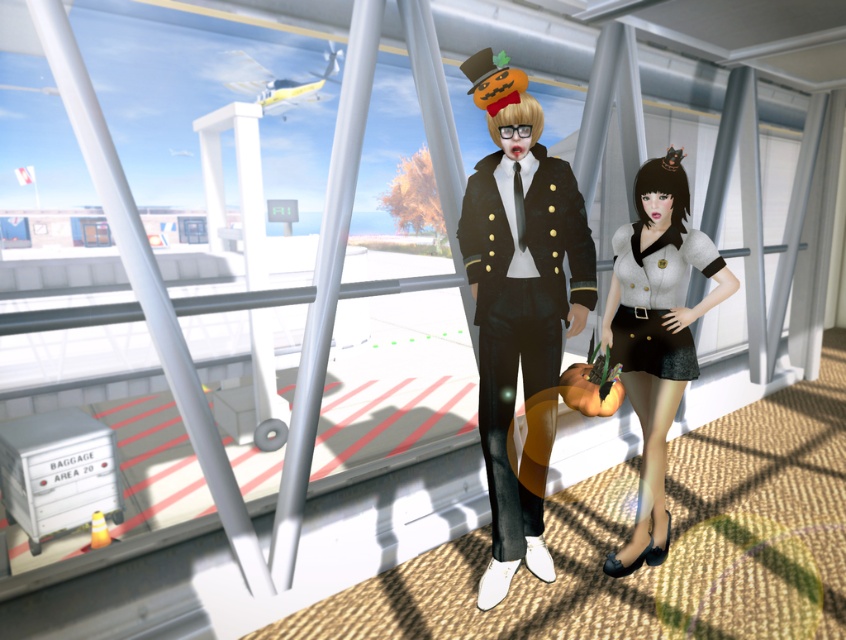
In order to click on shiny black uniform at center in this screenshot , I will do `click(522, 328)`.

Is point (509, 388) positioned behind point (652, 268)?

No.

Describe the element at coordinates (522, 328) in the screenshot. I see `shiny black uniform at center` at that location.

Where is `shiny black uniform at center`? shiny black uniform at center is located at coordinates (522, 328).

Does point (684, 260) lie behind point (630, 256)?

No, it is in front of (630, 256).

Between point (684, 176) and point (696, 371), which one is positioned behind?

Positioned behind is point (696, 371).

You are a GUI agent. You are given a task and a screenshot of the screen. Output one action in this format:
    pyautogui.click(x=<x>, y=<y>)
    Task: Click on the matte gray shirt at center
    
    Given the screenshot: What is the action you would take?
    656,333

The width and height of the screenshot is (846, 640). I want to click on shiny black uniform at center, so click(x=522, y=328).

Between point (545, 221) and point (658, 221), which one is positioned behind?

The point (658, 221) is behind.

Locate an element on the screen. shiny black uniform at center is located at coordinates (522, 328).